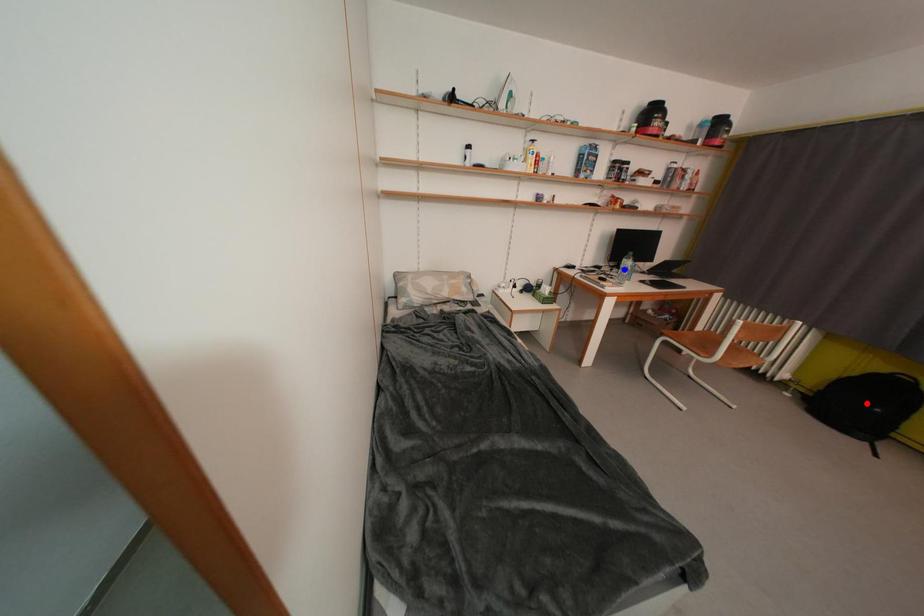
Question: Which of the two points in the image is closer to the camera?

Choices:
 (A) Blue point is closer.
 (B) Red point is closer.

Answer: (B)